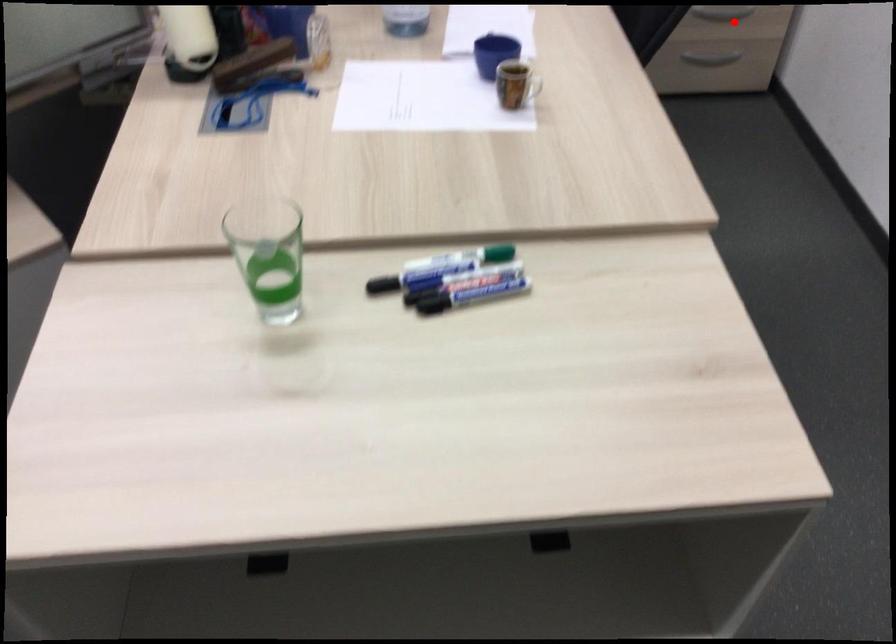
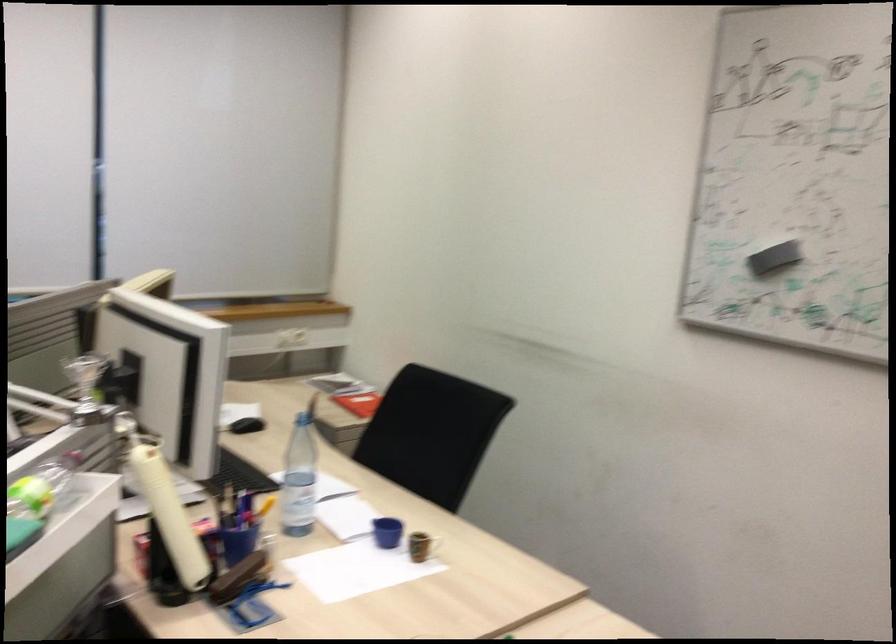
Question: I am providing you with two images of the same scene from different viewpoints. A red point is marked on the first image. At the location where the point appears in image 1, is it still visible in image 2?

Choices:
 (A) Yes
 (B) No

Answer: (B)